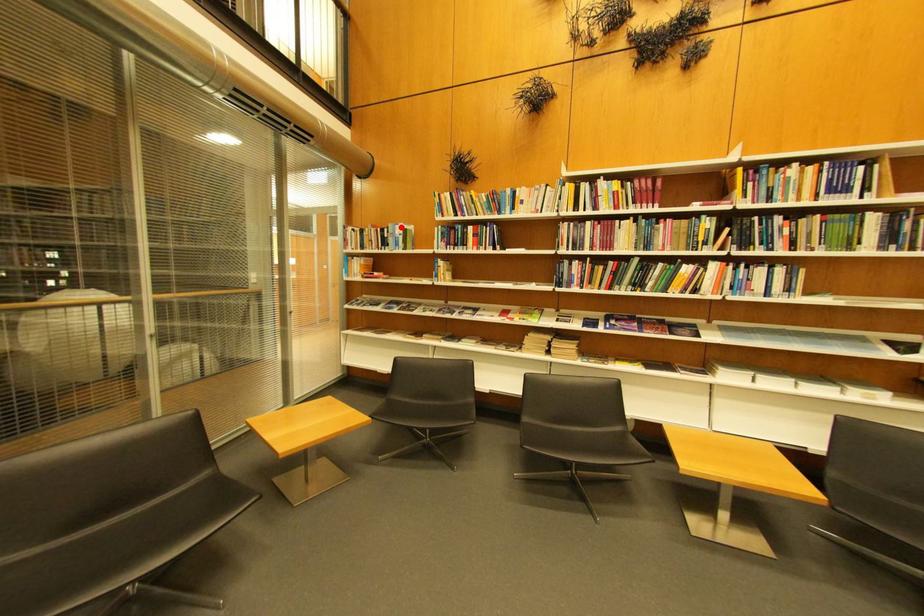
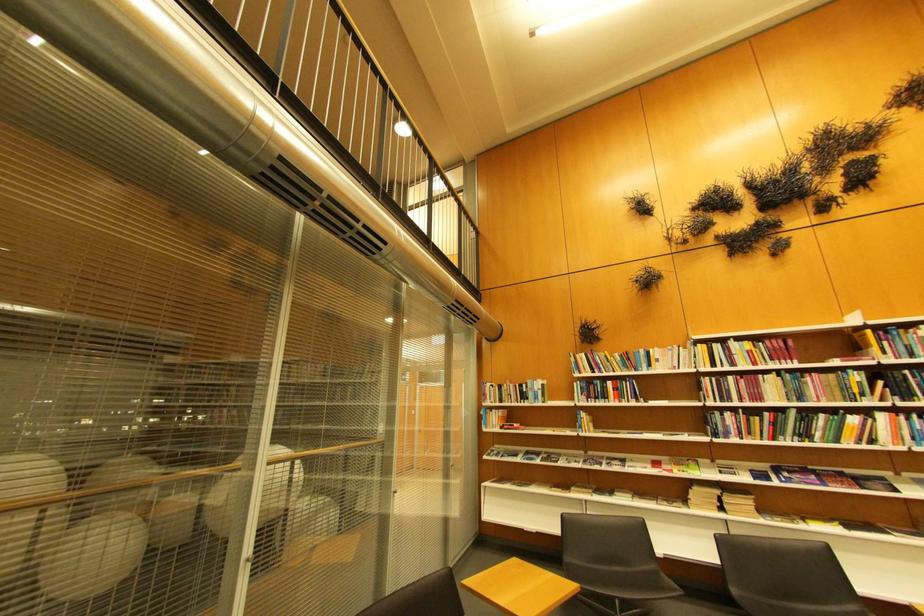
Question: I am providing you with two images of the same scene from different viewpoints. A red point is shown in image1. For the corresponding object point in image2, is it positioned nearer or farther from the camera?

Choices:
 (A) Nearer
 (B) Farther

Answer: (B)